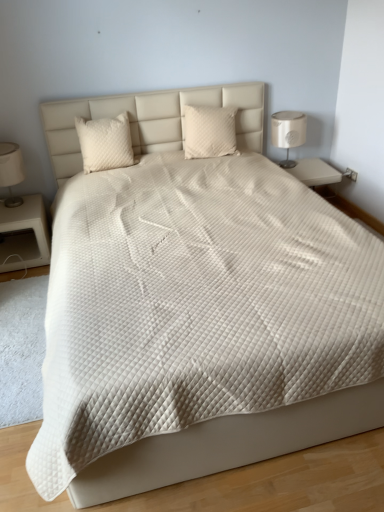
Question: Considering the relative positions of white soft carpet at lower left and matte white lampshade at left, which appears as the first bedside lamp when viewed from the left, in the image provided, is white soft carpet at lower left to the left of matte white lampshade at left, which appears as the first bedside lamp when viewed from the left, from the viewer's perspective?

Choices:
 (A) no
 (B) yes

Answer: (A)

Question: Can you confirm if white soft carpet at lower left is positioned to the right of matte white lampshade at left, positioned as the 2th bedside lamp in right-to-left order?

Choices:
 (A) no
 (B) yes

Answer: (B)

Question: Considering the relative sizes of white soft carpet at lower left and matte white lampshade at left, positioned as the 2th bedside lamp in right-to-left order, in the image provided, is white soft carpet at lower left taller than matte white lampshade at left, positioned as the 2th bedside lamp in right-to-left order,?

Choices:
 (A) yes
 (B) no

Answer: (B)

Question: From the image's perspective, is white soft carpet at lower left on matte white lampshade at left, positioned as the 2th bedside lamp in right-to-left order?

Choices:
 (A) yes
 (B) no

Answer: (B)

Question: Is white soft carpet at lower left oriented away from matte white lampshade at left, positioned as the 2th bedside lamp in right-to-left order?

Choices:
 (A) yes
 (B) no

Answer: (B)

Question: Could you tell me if white soft carpet at lower left is turned towards matte white lampshade at left, positioned as the 2th bedside lamp in right-to-left order?

Choices:
 (A) yes
 (B) no

Answer: (B)

Question: Can you confirm if white quilted pillow at upper left, the 2th pillow when ordered from right to left, is wider than matte white lampshade at left, which appears as the first bedside lamp when viewed from the left?

Choices:
 (A) yes
 (B) no

Answer: (B)

Question: Is white quilted pillow at upper left, the 2th pillow when ordered from right to left, bigger than matte white lampshade at left, which appears as the first bedside lamp when viewed from the left?

Choices:
 (A) yes
 (B) no

Answer: (B)

Question: From a real-world perspective, is white quilted pillow at upper left, the 2th pillow when ordered from right to left, positioned under matte white lampshade at left, positioned as the 2th bedside lamp in right-to-left order, based on gravity?

Choices:
 (A) yes
 (B) no

Answer: (B)

Question: Does white quilted pillow at upper left, the first pillow in the left-to-right sequence, lie behind matte white lampshade at left, positioned as the 2th bedside lamp in right-to-left order?

Choices:
 (A) yes
 (B) no

Answer: (A)

Question: Is white quilted pillow at upper left, the first pillow in the left-to-right sequence, looking in the opposite direction of matte white lampshade at left, positioned as the 2th bedside lamp in right-to-left order?

Choices:
 (A) no
 (B) yes

Answer: (A)

Question: Is white quilted pillow at upper left, the 2th pillow when ordered from right to left, thinner than matte white lampshade at left, which appears as the first bedside lamp when viewed from the left?

Choices:
 (A) no
 (B) yes

Answer: (B)

Question: From the image's perspective, is quilted beige pillow at center, arranged as the 2th pillow when viewed from the left, above white matte nightstand at left?

Choices:
 (A) yes
 (B) no

Answer: (A)